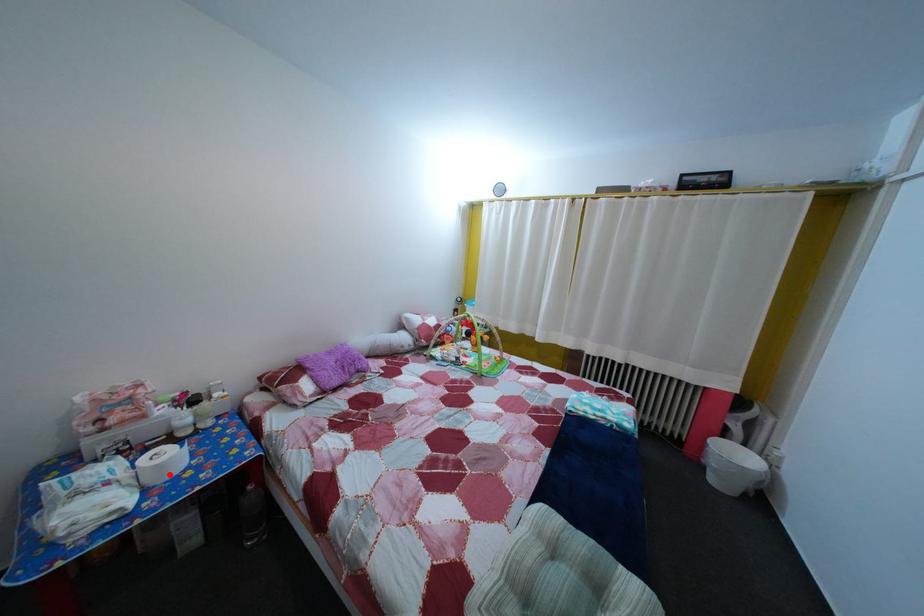
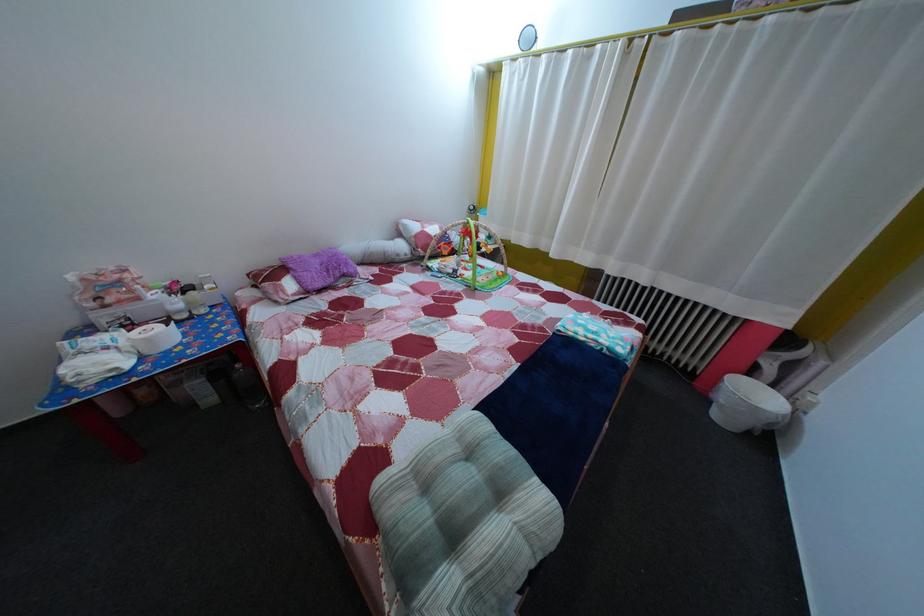
Question: I am providing you with two images of the same scene from different viewpoints. Image1 has a red point marked. In image2, the corresponding 3D location appears at what relative position? Reply with the corresponding letter.

Choices:
 (A) Closer
 (B) Farther

Answer: (B)